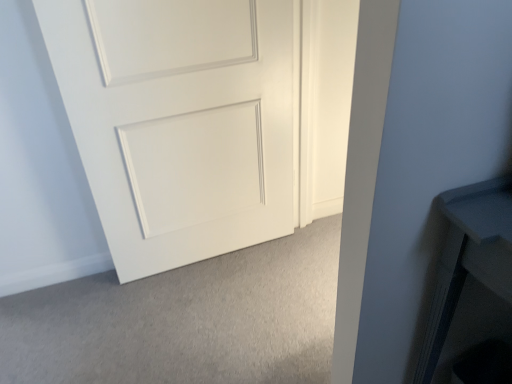
Describe the element at coordinates (179, 122) in the screenshot. This screenshot has height=384, width=512. I see `white matte door at center` at that location.

Identify the location of white matte door at center. This screenshot has width=512, height=384. (179, 122).

Find the location of a particular element. The height and width of the screenshot is (384, 512). white matte door at center is located at coordinates (179, 122).